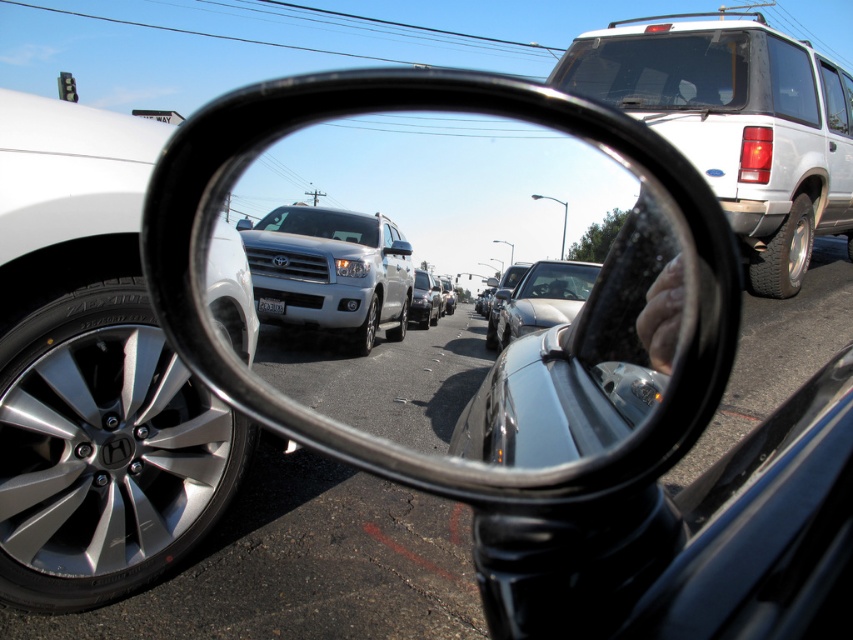
Question: Which object is positioned closest to the shiny silver sedan at center?

Choices:
 (A) black plastic license plate at center
 (B) glossy metallic mirror at center
 (C) white matte suv at right
 (D) silver metallic tire at left

Answer: (A)

Question: Can you confirm if silver metallic tire at left is thinner than silver metallic suv at center?

Choices:
 (A) no
 (B) yes

Answer: (B)

Question: Does silver metallic suv at center appear on the left side of black plastic license plate at center?

Choices:
 (A) no
 (B) yes

Answer: (A)

Question: Is silver metallic tire at left closer to camera compared to silver metallic sedan at center?

Choices:
 (A) no
 (B) yes

Answer: (B)

Question: Which point is farther from the camera taking this photo?

Choices:
 (A) (380, 292)
 (B) (753, 84)
 (C) (595, 524)
 (D) (267, 301)

Answer: (A)

Question: Estimate the real-world distances between objects in this image. Which object is closer to the silver metallic sedan at center?

Choices:
 (A) black rubber mirror at center
 (B) glossy metallic mirror at center
 (C) silver metallic tire at left

Answer: (B)